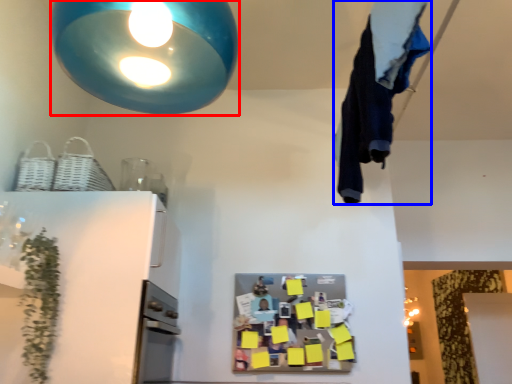
Question: Which point is closer to the camera, lamp (highlighted by a red box) or laundry (highlighted by a blue box)?

Choices:
 (A) lamp
 (B) laundry

Answer: (A)